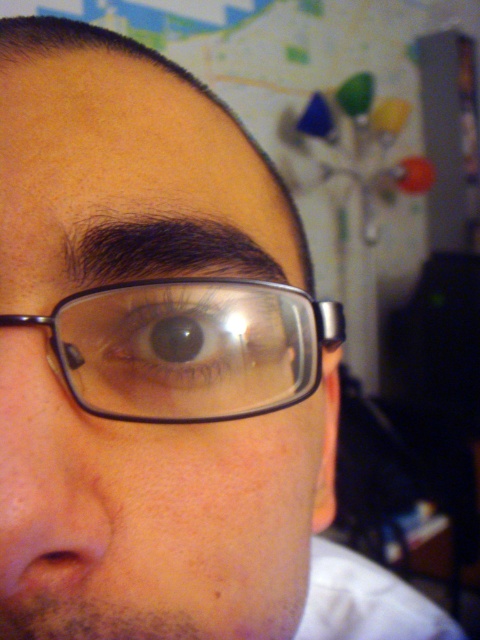
Consider the image. You are designing a frame for an accessory that needs to fit around the transparent plastic glasses at center and the brown glossy eye at center. Based on the size comparison between them, which object should the frame be designed to accommodate first?

The transparent plastic glasses at center is bigger than the brown glossy eye at center, so the frame should be designed to accommodate the transparent plastic glasses at center first to ensure it fits both objects properly.

You are a photographer adjusting your camera settings to focus on the transparent plastic glasses at center and the brown glossy eye at center. Which object should you focus on first if you want to capture both in sharp detail?

The transparent plastic glasses at center is below the brown glossy eye at center, so you should focus on the brown glossy eye at center first since it is closer to the camera.

You are a photographer adjusting the focus on your camera. You notice the clear plastic glasses at center and the brown glossy eye at center in your frame. Which object should you focus on if you want to ensure the taller object is sharp?

The clear plastic glasses at center is taller than the brown glossy eye at center, so you should focus on the clear plastic glasses at center to ensure the taller object is sharp.